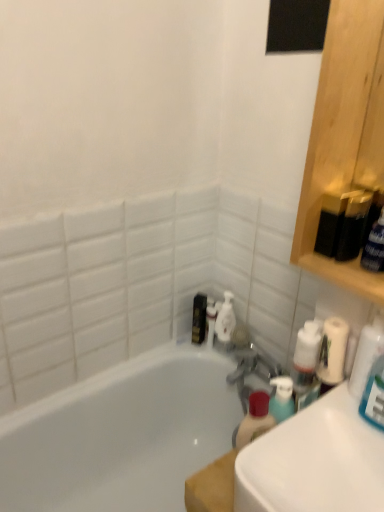
Question: From a real-world perspective, is metallic gold toiletry at center, which is counted as the first toiletry, starting from the left, physically located above or below white glossy bathtub at center?

Choices:
 (A) below
 (B) above

Answer: (B)

Question: Is metallic gold toiletry at center, acting as the second toiletry starting from the right, bigger or smaller than white glossy bathtub at center?

Choices:
 (A) small
 (B) big

Answer: (A)

Question: Which object is the farthest from the white glossy bathtub at center?

Choices:
 (A) white glossy sink at lower right
 (B) metallic gold toiletry at center, which is counted as the first toiletry, starting from the left
 (C) white plastic soap dispenser at lower center, arranged as the second toiletry when viewed from the left
 (D) white glossy bottle at center

Answer: (A)

Question: Based on their relative distances, which object is nearer to the white plastic soap dispenser at lower center, the first toiletry positioned from the right?

Choices:
 (A) white glossy sink at lower right
 (B) metallic gold toiletry at center, acting as the second toiletry starting from the right
 (C) white glossy bathtub at center
 (D) white glossy bottle at center

Answer: (D)